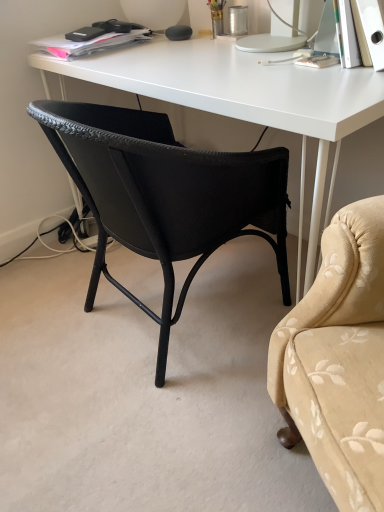
Question: Is white matte desk at center wider or thinner than matte black charger at upper left?

Choices:
 (A) thin
 (B) wide

Answer: (B)

Question: Which is correct: white matte desk at center is inside matte black charger at upper left, or outside of it?

Choices:
 (A) inside
 (B) outside

Answer: (B)

Question: Estimate the real-world distances between objects in this image. Which object is closer to the matte black charger at upper left?

Choices:
 (A) black woven chair at center
 (B) white matte desk at center

Answer: (B)

Question: Which is farther from the matte black charger at upper left?

Choices:
 (A) black woven chair at center
 (B) white matte desk at center

Answer: (A)